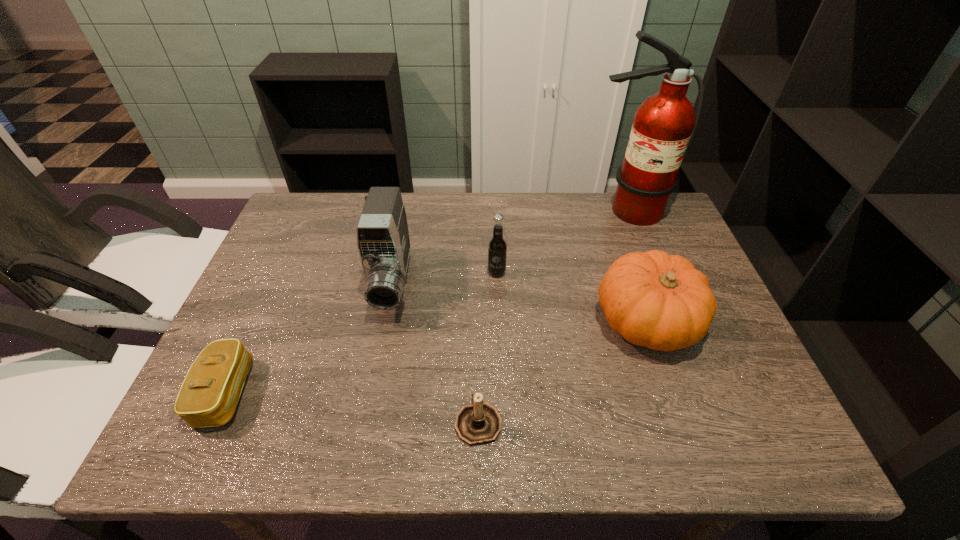
This screenshot has height=540, width=960. I want to click on blank space that satisfies the following two spatial constraints: 1. at the front of the fifth object from right to left, highlighting the lens; 2. on the left side of the fifth tallest object, so click(366, 421).

Locate an element on the screen. blank space that satisfies the following two spatial constraints: 1. on the label of the root beer; 2. on the zipper side of the leftmost object is located at coordinates click(x=501, y=393).

The width and height of the screenshot is (960, 540). I want to click on vacant space that satisfies the following two spatial constraints: 1. on the nozzle and handle of the tallest object; 2. on the zipper side of the shortest object, so click(x=696, y=393).

Find the location of a particular element. This screenshot has height=540, width=960. free space that satisfies the following two spatial constraints: 1. on the zipper side of the fifth tallest object; 2. on the right side of the leftmost object is located at coordinates (213, 421).